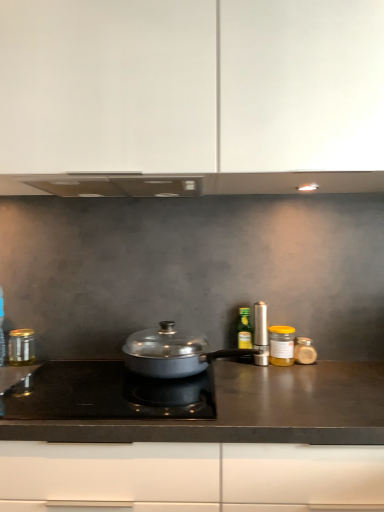
Find the location of `free space in front of matte silver pan at center, which appears as the 5th kitchen appliance when viewed from the right`. free space in front of matte silver pan at center, which appears as the 5th kitchen appliance when viewed from the right is located at coordinates (210, 404).